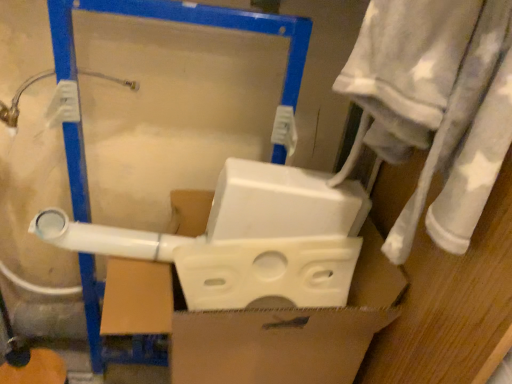
What do you see at coordinates (256, 325) in the screenshot? I see `brown cardboard at center` at bounding box center [256, 325].

The image size is (512, 384). Find the location of `brown cardboard at center`. brown cardboard at center is located at coordinates (256, 325).

Where is `brown cardboard at center`? The image size is (512, 384). brown cardboard at center is located at coordinates (256, 325).